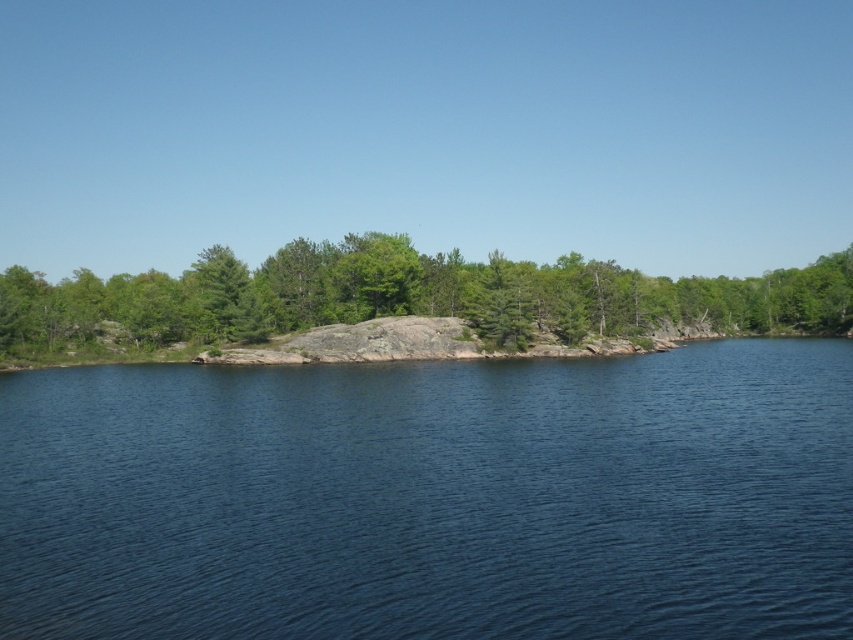
Question: Considering the relative positions of blue water at center and green textured rock at center in the image provided, where is blue water at center located with respect to green textured rock at center?

Choices:
 (A) left
 (B) right

Answer: (B)

Question: Can you confirm if blue water at center is positioned to the left of green textured rock at center?

Choices:
 (A) no
 (B) yes

Answer: (A)

Question: Which of the following is the closest to the observer?

Choices:
 (A) blue water at center
 (B) green textured rock at center

Answer: (A)

Question: Can you confirm if blue water at center is bigger than green textured rock at center?

Choices:
 (A) no
 (B) yes

Answer: (A)

Question: Which point is closer to the camera taking this photo?

Choices:
 (A) (250, 298)
 (B) (94, 369)

Answer: (B)